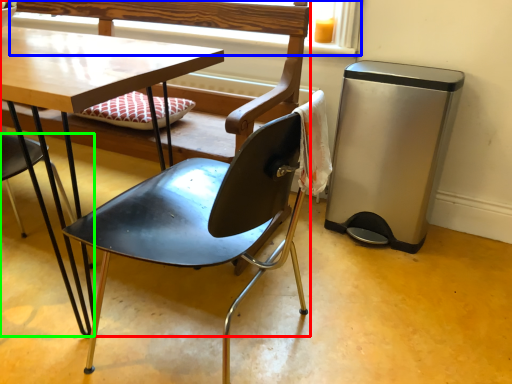
Question: Which is nearer to the chair (highlighted by a red box)? window frame (highlighted by a blue box) or chair (highlighted by a green box).

Choices:
 (A) window frame
 (B) chair

Answer: (B)